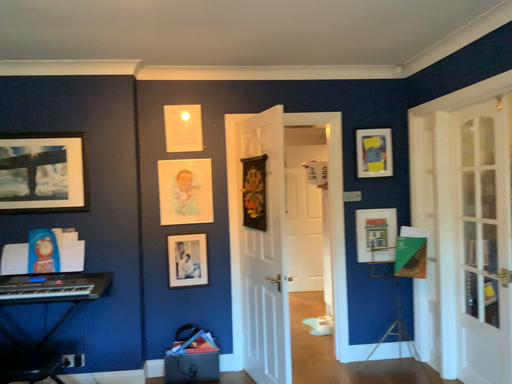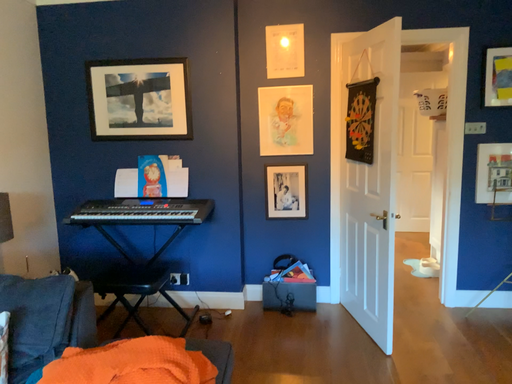
Question: Which way did the camera rotate in the video?

Choices:
 (A) rotated upward
 (B) rotated downward

Answer: (B)